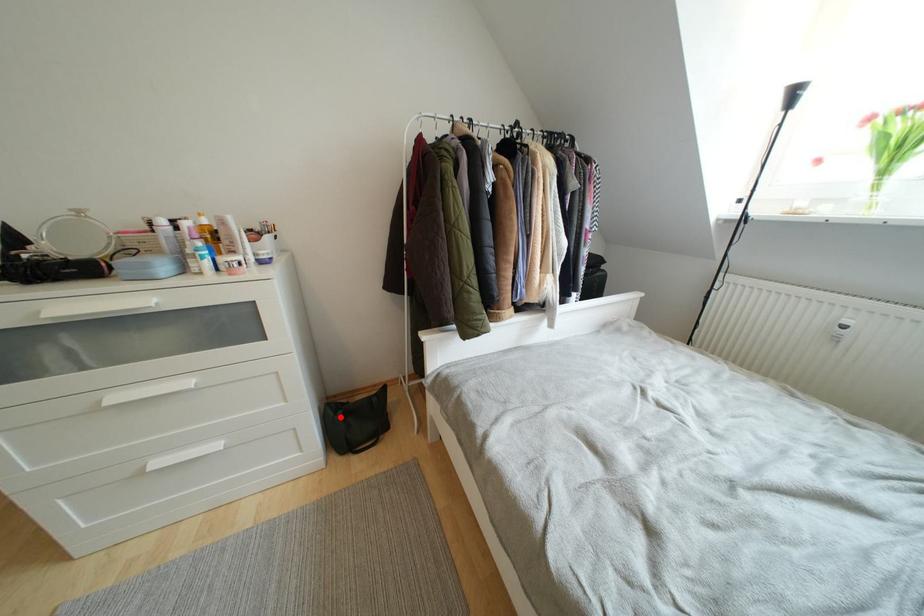
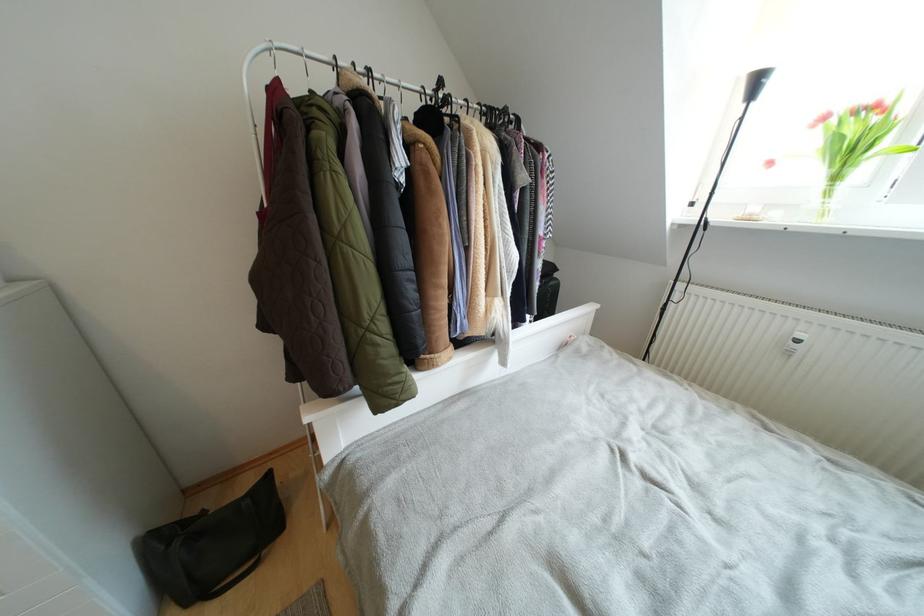
Where in the second image is the point corresponding to the highlighted location from the first image?

(175, 549)